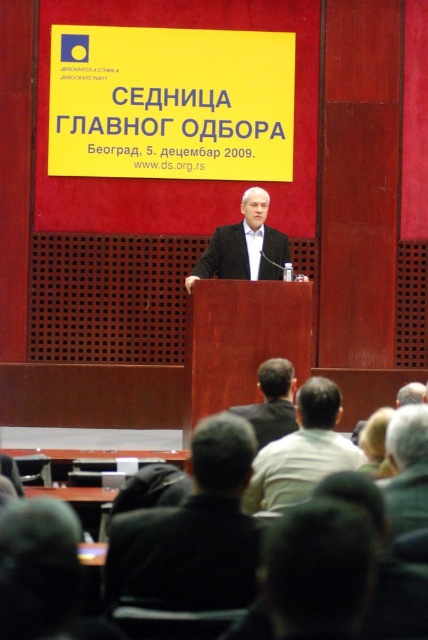
Is dark suit at center above light brown hair at lower right?

Correct, dark suit at center is located above light brown hair at lower right.

Does dark suit at center have a greater width compared to light brown hair at lower right?

Yes, dark suit at center is wider than light brown hair at lower right.

Where is `dark suit at center`? This screenshot has height=640, width=428. dark suit at center is located at coordinates (244, 246).

Is the position of light brown hair at lower right more distant than that of dark brown hair at center?

That is False.

Can you confirm if light brown hair at lower right is thinner than dark brown hair at center?

Indeed, light brown hair at lower right has a lesser width compared to dark brown hair at center.

Does point (404, 412) lie in front of point (294, 429)?

Yes, point (404, 412) is closer to viewer.

Locate an element on the screen. The height and width of the screenshot is (640, 428). light brown hair at lower right is located at coordinates (407, 468).

Is white cotton shirt at center smaller than light brown hair at lower right?

No, white cotton shirt at center is not smaller than light brown hair at lower right.

Does white cotton shirt at center come in front of light brown hair at lower right?

No, it is not.

Who is more forward, (299,397) or (416,461)?

Positioned in front is point (416,461).

Locate an element on the screen. white cotton shirt at center is located at coordinates (302, 451).